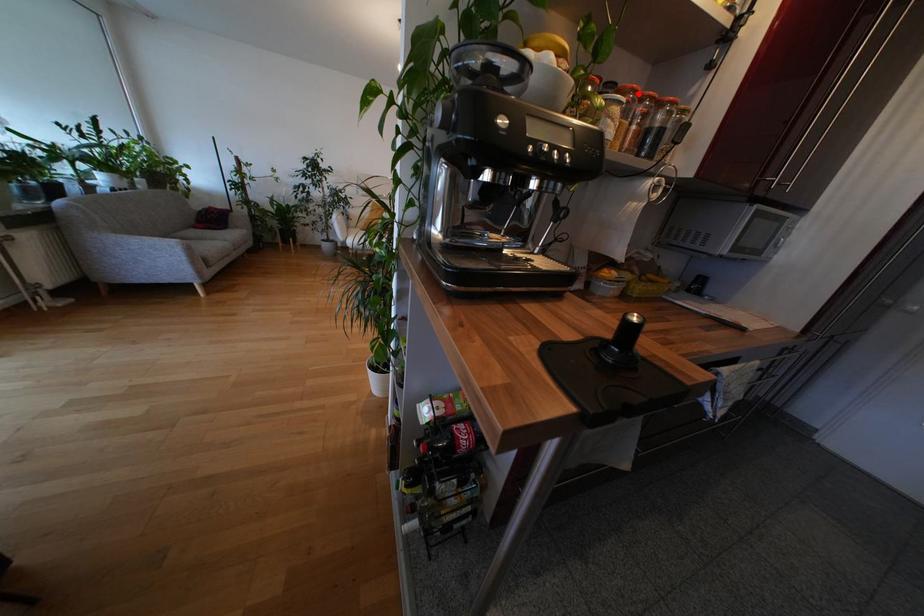
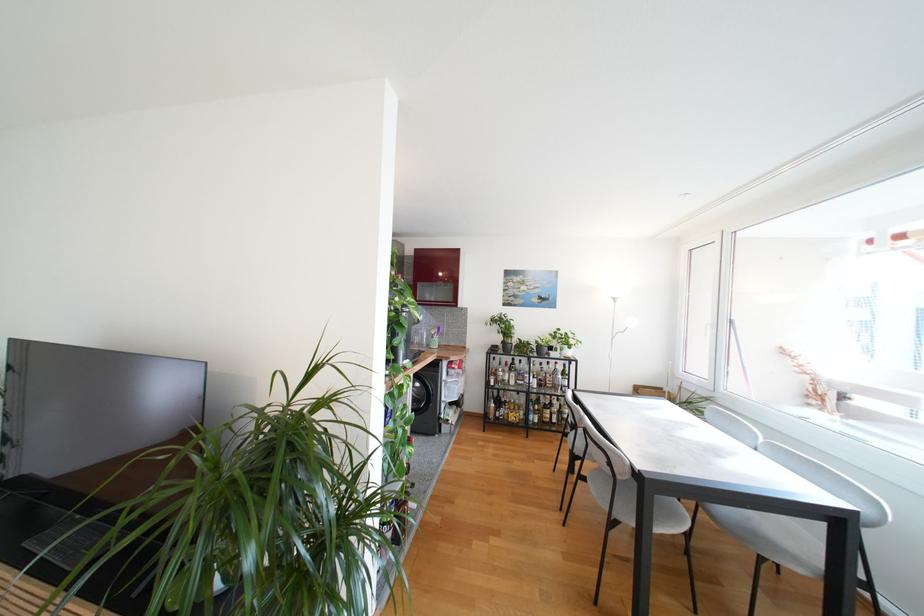
Question: I am providing you with two images of the same scene from different viewpoints. A red point is marked on the first image. Is the red point's position out of view in image 2?

Choices:
 (A) Yes
 (B) No

Answer: (A)